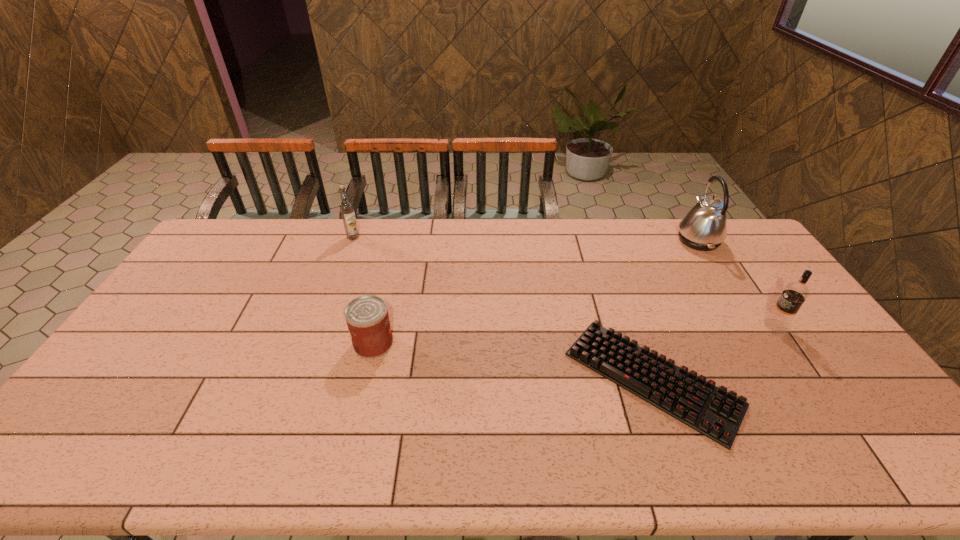
Find the location of `kettle at the right edge`. kettle at the right edge is located at coordinates (704, 228).

I want to click on vodka located at the right edge, so click(794, 294).

Where is `object present at the far right corner`? The image size is (960, 540). object present at the far right corner is located at coordinates (704, 228).

The height and width of the screenshot is (540, 960). I want to click on free space at the far edge, so click(x=473, y=242).

In the image, there is a desktop. Where is `vacant space at the near edge`? The image size is (960, 540). vacant space at the near edge is located at coordinates pyautogui.click(x=418, y=470).

I want to click on free space at the left edge, so click(129, 348).

I want to click on vacant space at the right edge, so click(855, 418).

At what (x,y) coordinates should I click in order to perform the action: click on vacant space at the far left corner. Please return your answer as a coordinate pair (x, y). The image size is (960, 540). Looking at the image, I should click on (244, 244).

The width and height of the screenshot is (960, 540). In the image, there is a desktop. In order to click on free space at the near right corner in this screenshot , I will do [x=875, y=441].

Where is `empty space that is in between the kettle and the computer keyboard`? The height and width of the screenshot is (540, 960). empty space that is in between the kettle and the computer keyboard is located at coordinates (675, 309).